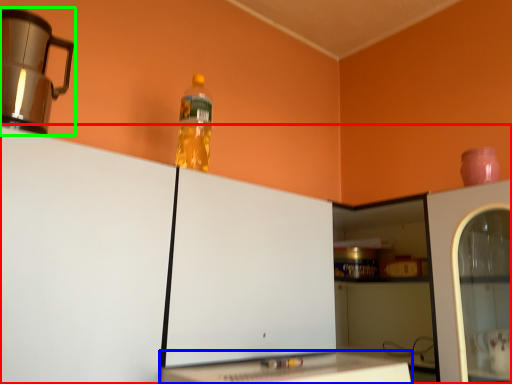
Question: Which is nearer to the cabinetry (highlighted by a red box)? table (highlighted by a blue box) or home appliance (highlighted by a green box).

Choices:
 (A) table
 (B) home appliance

Answer: (A)